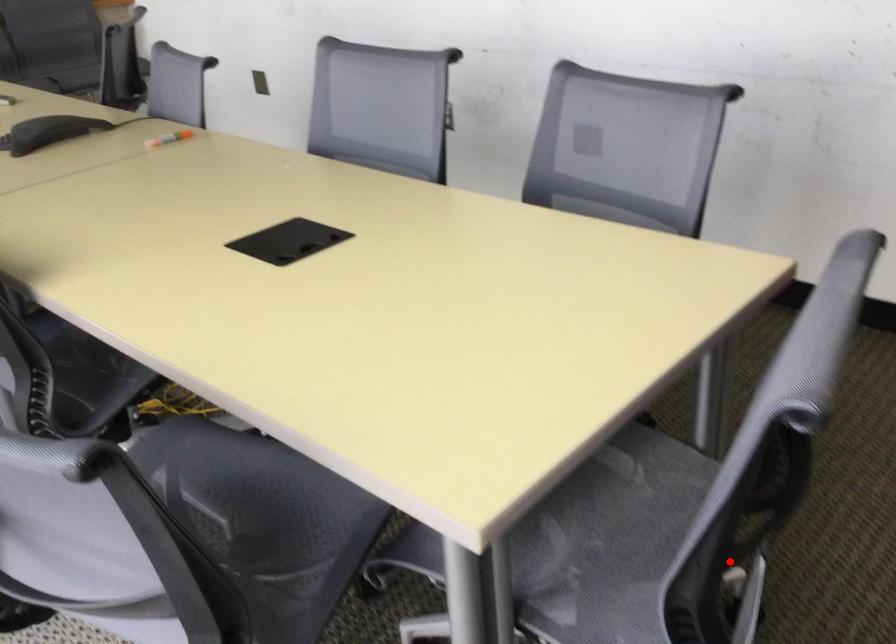
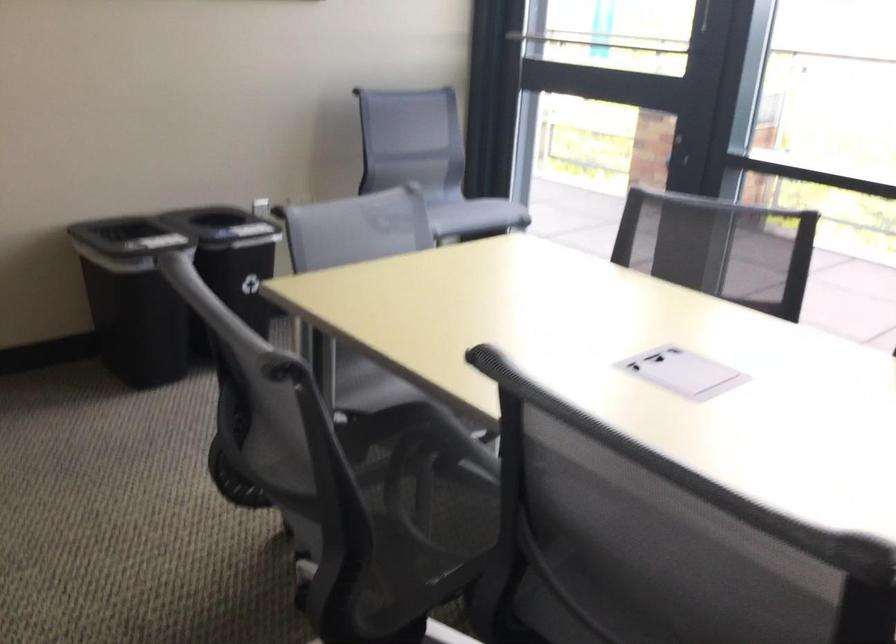
Where in the second image is the point corresponding to the highlighted location from the first image?

(356, 361)